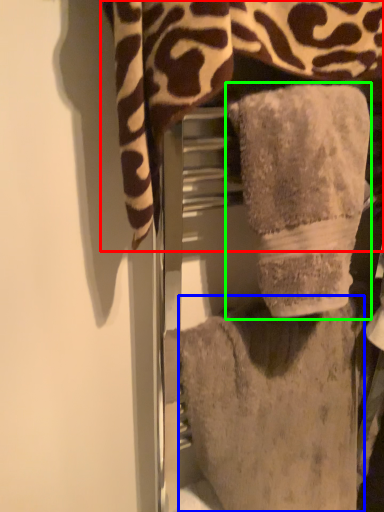
Question: Based on their relative distances, which object is farther from towel (highlighted by a red box)? Choose from towel (highlighted by a blue box) and towel (highlighted by a green box).

Choices:
 (A) towel
 (B) towel

Answer: (A)